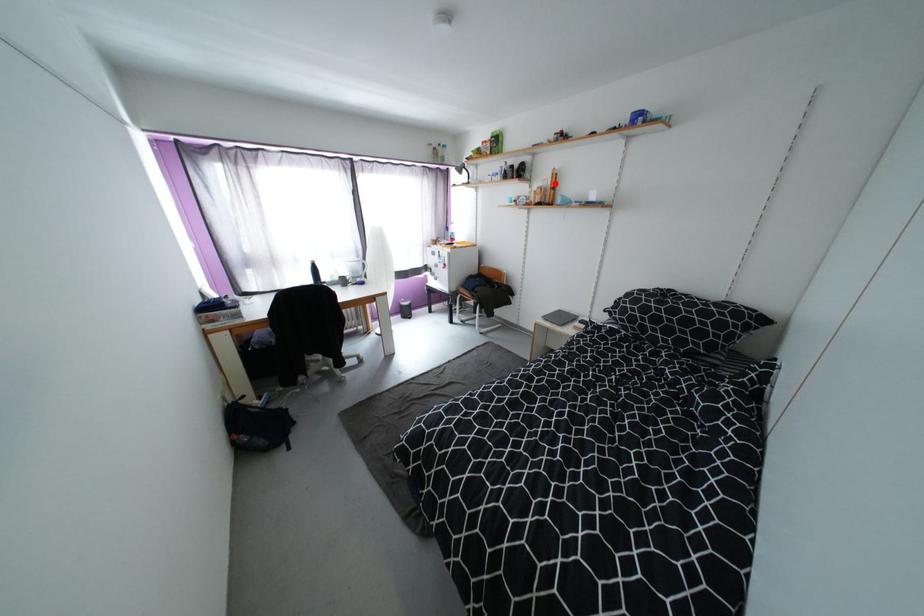
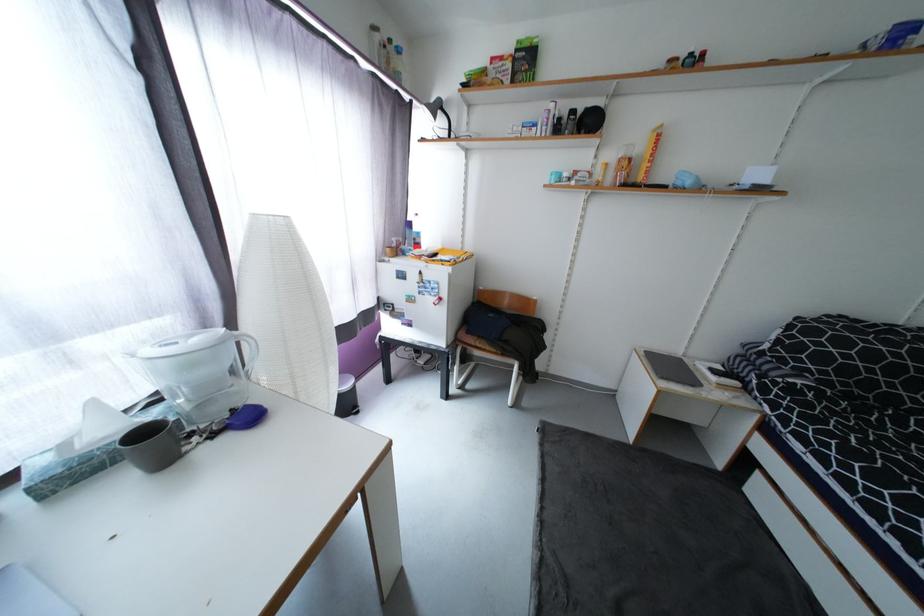
Where in the second image is the point corresponding to the highlighted location from the first image?

(647, 151)